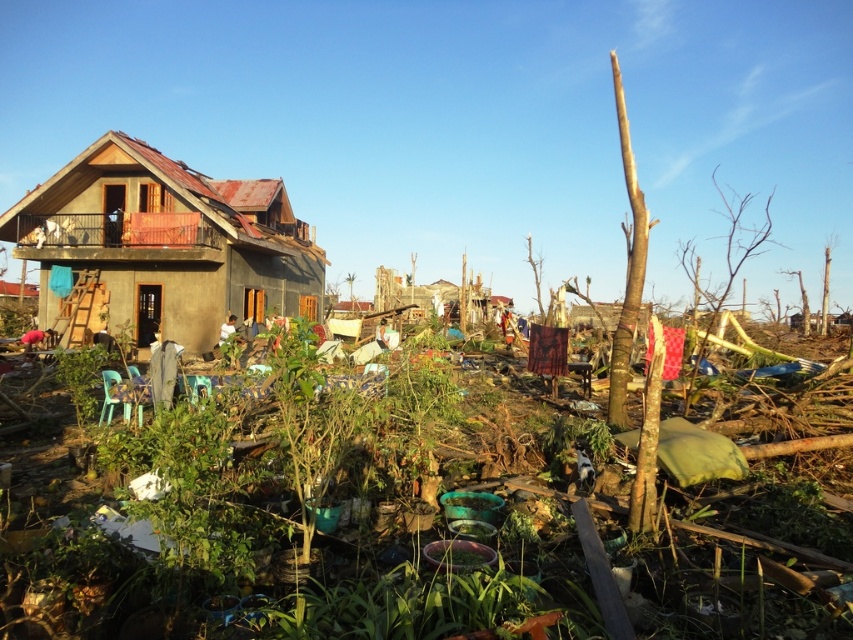
Can you confirm if brown wooden debris at center is shorter than matte brown house at left?

Yes.

Can you confirm if brown wooden debris at center is positioned below matte brown house at left?

Yes, brown wooden debris at center is below matte brown house at left.

Does point (166, 531) lie behind point (152, 308)?

That is False.

You are a GUI agent. You are given a task and a screenshot of the screen. Output one action in this format:
    pyautogui.click(x=<x>, y=<y>)
    Task: Click on the brown wooden debris at center
    The height and width of the screenshot is (640, 853).
    Given the screenshot: What is the action you would take?
    pyautogui.click(x=393, y=525)